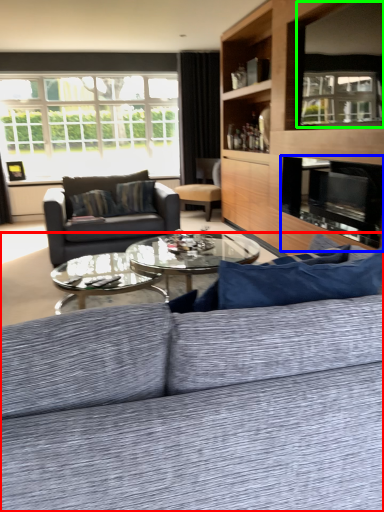
Question: Estimate the real-world distances between objects in this image. Which object is closer to studio couch (highlighted by a red box), fireplace (highlighted by a blue box) or window screen (highlighted by a green box)?

Choices:
 (A) fireplace
 (B) window screen

Answer: (A)